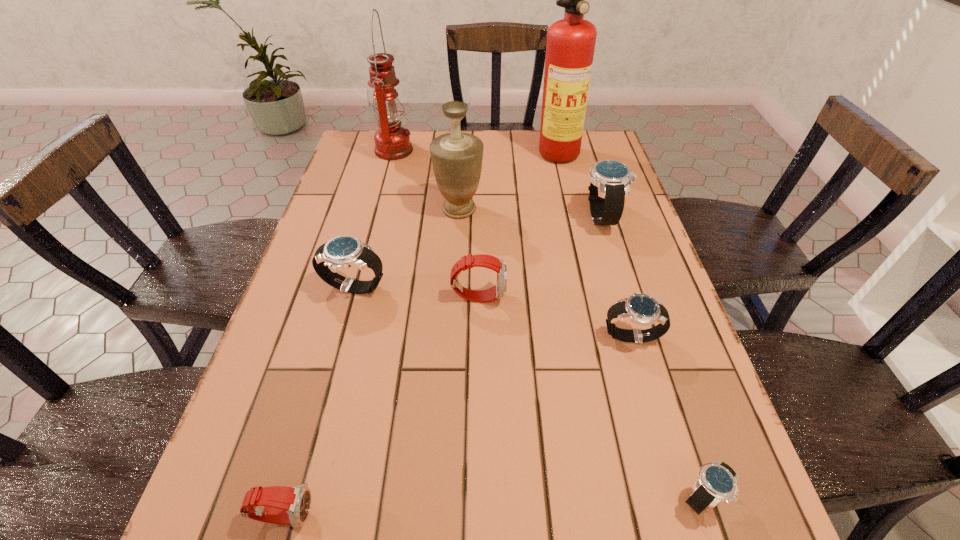
Where is `fire extinguisher`? fire extinguisher is located at coordinates (570, 46).

Locate an element on the screen. red fire extinguisher is located at coordinates (570, 46).

The height and width of the screenshot is (540, 960). I want to click on oil lamp, so click(x=392, y=141).

At what (x,y) coordinates should I click in order to perform the action: click on the eighth shortest object. Please return your answer as a coordinate pair (x, y). Looking at the image, I should click on (392, 141).

This screenshot has height=540, width=960. I want to click on the seventh shortest object, so click(x=456, y=157).

I want to click on the sixth shortest object, so click(610, 180).

Find the location of `the biggest silver watch`. the biggest silver watch is located at coordinates (610, 180).

The image size is (960, 540). I want to click on the third nearest silver watch, so click(x=341, y=252).

I want to click on the third smallest silver watch, so click(x=341, y=252).

Locate an element on the screen. Image resolution: width=960 pixels, height=540 pixels. the right red watch is located at coordinates (498, 291).